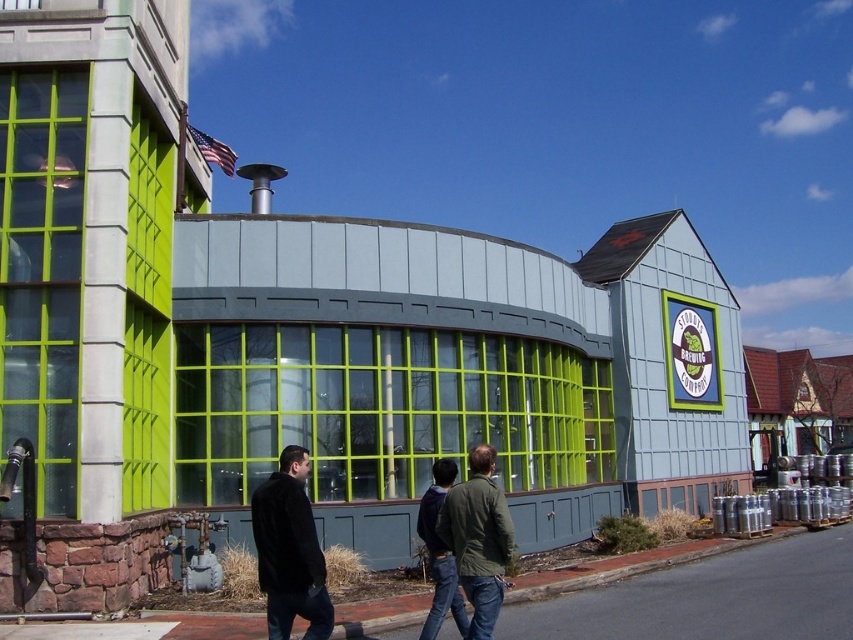
You are driving a car that is 18 feet long. You see the smooth asphalt road at lower center and the black fuzzy coat at center. Can your car fit entirely between them?

The distance between the smooth asphalt road at lower center and the black fuzzy coat at center is 20.22 feet. Since your car is 18 feet long, it can fit entirely between them as there is enough space.

You are a delivery person standing in front of the building. You need to place a package between the green fabric jacket at center and the black fuzzy coat at center. Is there enough space to place the package between them?

The distance between the green fabric jacket at center and the black fuzzy coat at center is 1.86 meters. Since the package requires space, it can be placed between them as there is sufficient distance available.

You are a delivery driver approaching the Stoudts Brewing Company building. You need to park your vehicle on the smooth asphalt road at lower center. However, there is a green fabric jacket at center in the way. Can your vehicle fit on the road if you move the jacket?

The smooth asphalt road at lower center is larger in size than the green fabric jacket at center, so moving the jacket would allow the vehicle to fit on the road since the road is spacious enough compared to the jacket.